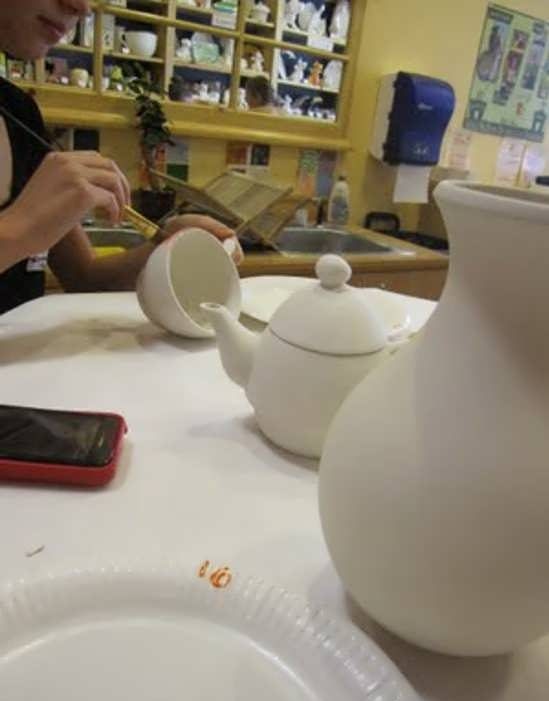
Locate an element on the screen. sink is located at coordinates (308, 240).